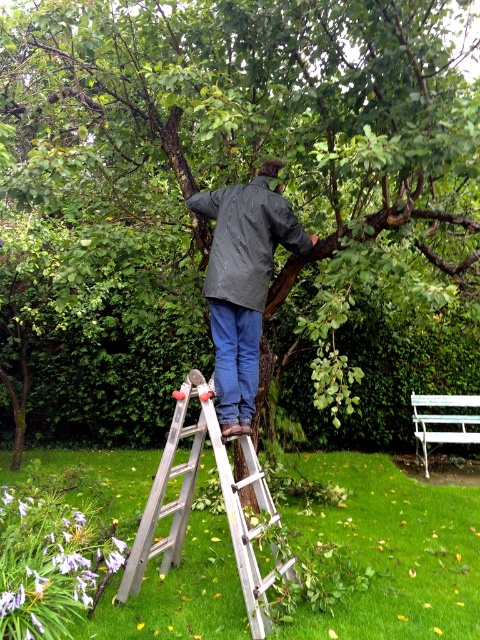
Question: Which of the following is the farthest from the observer?

Choices:
 (A) dark gray jacket at center
 (B) silver metallic ladder at center
 (C) green rough bark tree at upper center
 (D) white painted wood park bench at lower right

Answer: (D)

Question: Does green rough bark tree at upper center appear under white painted wood park bench at lower right?

Choices:
 (A) no
 (B) yes

Answer: (A)

Question: Is green rough bark tree at upper center to the left of dark gray jacket at center from the viewer's perspective?

Choices:
 (A) no
 (B) yes

Answer: (A)

Question: Is dark gray jacket at center closer to the viewer compared to white painted wood park bench at lower right?

Choices:
 (A) yes
 (B) no

Answer: (A)

Question: Considering the real-world distances, which object is closest to the green rough bark tree at upper center?

Choices:
 (A) silver metallic ladder at center
 (B) dark gray jacket at center

Answer: (B)

Question: Which point appears closest to the camera in this image?

Choices:
 (A) (227, 381)
 (B) (422, 410)

Answer: (A)